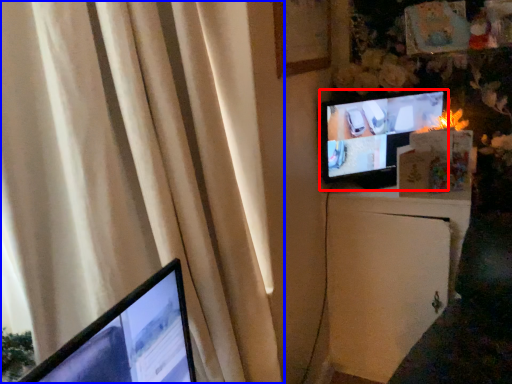
Question: Which object appears farthest to the camera in this image, television (highlighted by a red box) or curtain (highlighted by a blue box)?

Choices:
 (A) television
 (B) curtain

Answer: (A)